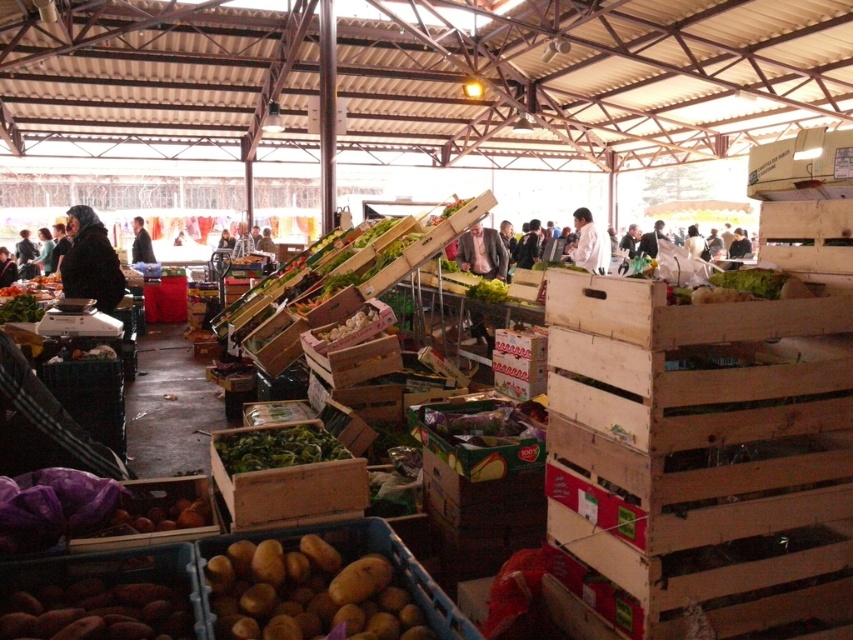
Question: Estimate the real-world distances between objects in this image. Which object is farther from the dark gray sweater at left?

Choices:
 (A) dark gray jacket at center
 (B) matte gray suit at center

Answer: (B)

Question: From the image, what is the correct spatial relationship of green leafy vegetable at center in relation to black fabric jacket at left?

Choices:
 (A) above
 (B) below

Answer: (B)

Question: Is green leafy vegetable at center to the left of black fabric jacket at left from the viewer's perspective?

Choices:
 (A) yes
 (B) no

Answer: (B)

Question: Estimate the real-world distances between objects in this image. Which object is farther from the black fabric at left?

Choices:
 (A) green leafy at center
 (B) black fabric jacket at left

Answer: (B)

Question: Estimate the real-world distances between objects in this image. Which object is closer to the black fabric at left?

Choices:
 (A) dark gray sweater at left
 (B) white fabric at center
 (C) dark brown leather jacket at left
 (D) green leafy vegetable at center

Answer: (D)

Question: Is black fabric at left to the right of dark brown leather jacket at left from the viewer's perspective?

Choices:
 (A) no
 (B) yes

Answer: (B)